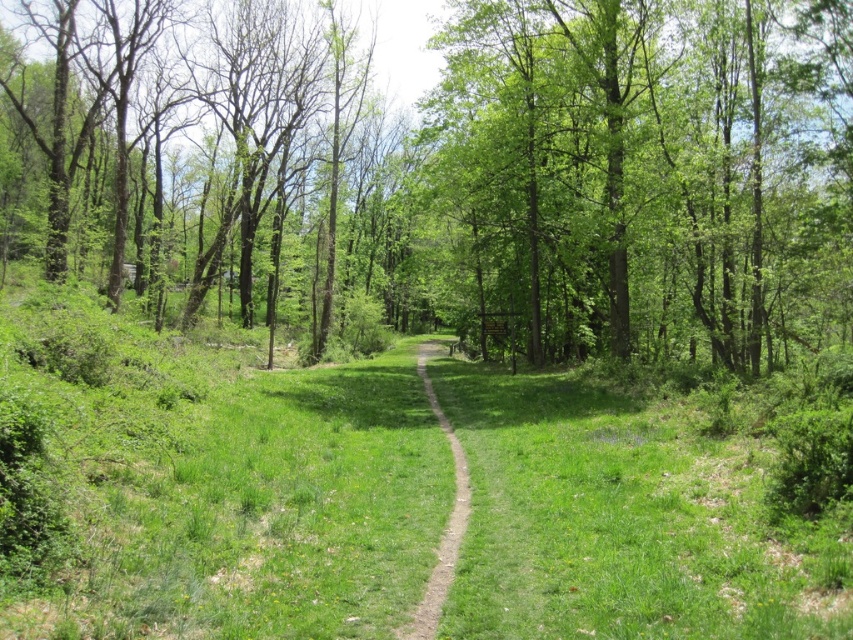
Can you confirm if green leafy tree at center is positioned above dirt path at center?

Correct, green leafy tree at center is located above dirt path at center.

Who is positioned more to the right, green leafy tree at center or dirt path at center?

dirt path at center is more to the right.

Measure the distance between green leafy tree at center and camera.

They are 70.69 feet apart.

You are a GUI agent. You are given a task and a screenshot of the screen. Output one action in this format:
    pyautogui.click(x=<x>, y=<y>)
    Task: Click on the green leafy tree at center
    The width and height of the screenshot is (853, 640).
    Given the screenshot: What is the action you would take?
    pyautogui.click(x=456, y=170)